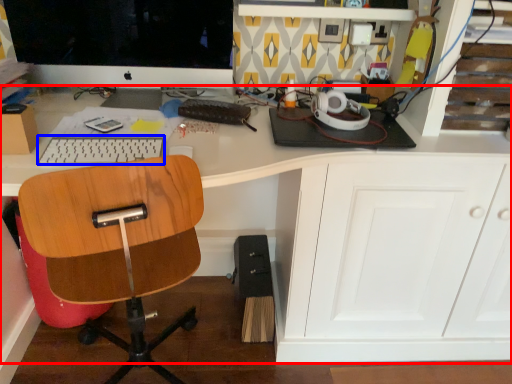
Question: Which object is further to the camera taking this photo, desk (highlighted by a red box) or keyboard (highlighted by a blue box)?

Choices:
 (A) desk
 (B) keyboard

Answer: (B)